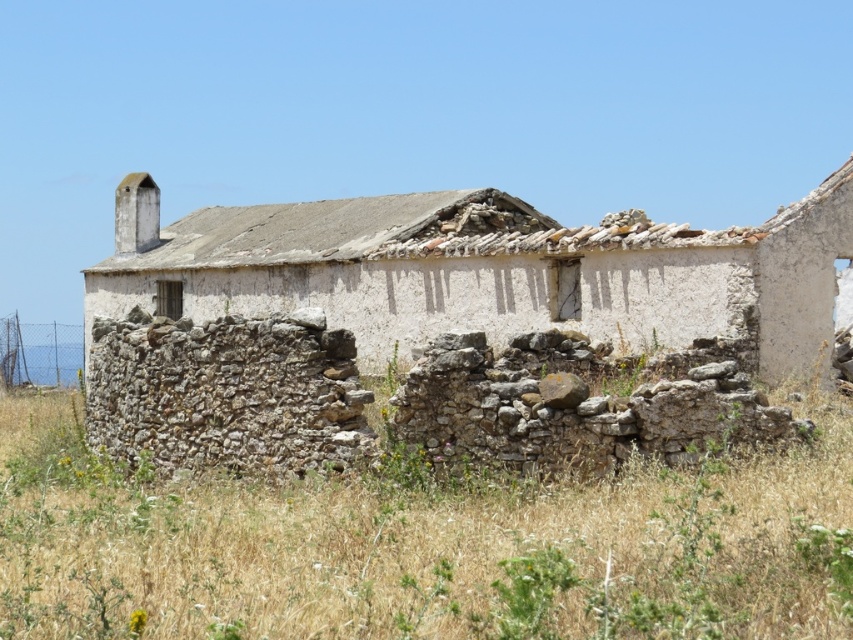
Question: Is dry grass at lower center above white stucco wall at center?

Choices:
 (A) no
 (B) yes

Answer: (A)

Question: Which object appears farthest from the camera in this image?

Choices:
 (A) dry grass at lower center
 (B) white stucco wall at center

Answer: (B)

Question: Can you confirm if dry grass at lower center is positioned below white stucco wall at center?

Choices:
 (A) no
 (B) yes

Answer: (B)

Question: Which point is closer to the camera?

Choices:
 (A) (134, 196)
 (B) (836, 417)

Answer: (B)

Question: Is dry grass at lower center to the right of white stucco wall at center from the viewer's perspective?

Choices:
 (A) no
 (B) yes

Answer: (B)